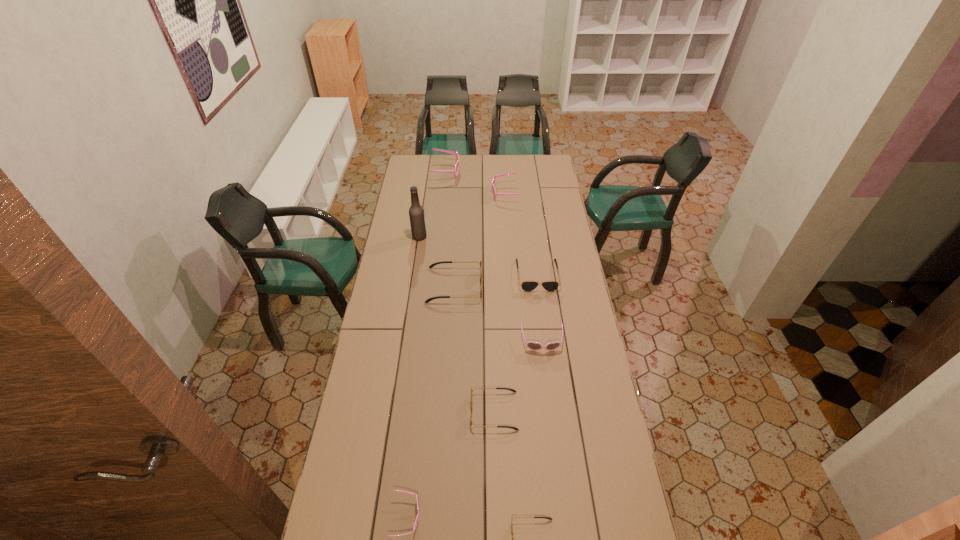
Find the location of a particular element. This screenshot has height=540, width=960. free area in between the fourth nearest object and the third nearest pink sunglasses is located at coordinates (523, 268).

Find the location of a particular element. The image size is (960, 540). object that is the fifth closest to the nearest pink sunglasses is located at coordinates (527, 285).

Select which object appears as the eighth closest to the eighth nearest object. Please provide its 2D coordinates. Your answer should be formatted as a tuple, i.e. [(x, y)], where the tuple contains the x and y coordinates of a point satisfying the conditions above.

[(513, 517)]

Locate which sunglasses is the sixth closest to the shortest object. Please provide its 2D coordinates. Your answer should be formatted as a tuple, i.e. [(x, y)], where the tuple contains the x and y coordinates of a point satisfying the conditions above.

[(494, 178)]

This screenshot has width=960, height=540. Identify the location of sunglasses that is the fifth closest one to the biggest black sunglasses. (455, 171).

Select which pink sunglasses appears as the third closest to the tallest object. Please provide its 2D coordinates. Your answer should be formatted as a tuple, i.e. [(x, y)], where the tuple contains the x and y coordinates of a point satisfying the conditions above.

[(534, 346)]

Locate which pink sunglasses ranks in proximity to the fourth nearest sunglasses. Please provide its 2D coordinates. Your answer should be formatted as a tuple, i.e. [(x, y)], where the tuple contains the x and y coordinates of a point satisfying the conditions above.

[(417, 517)]

Identify which black sunglasses is the fourth closest to the nearest pink sunglasses. Please provide its 2D coordinates. Your answer should be formatted as a tuple, i.e. [(x, y)], where the tuple contains the x and y coordinates of a point satisfying the conditions above.

[(527, 285)]

Find the location of `the second closest black sunglasses to the second biggest black sunglasses`. the second closest black sunglasses to the second biggest black sunglasses is located at coordinates (512, 390).